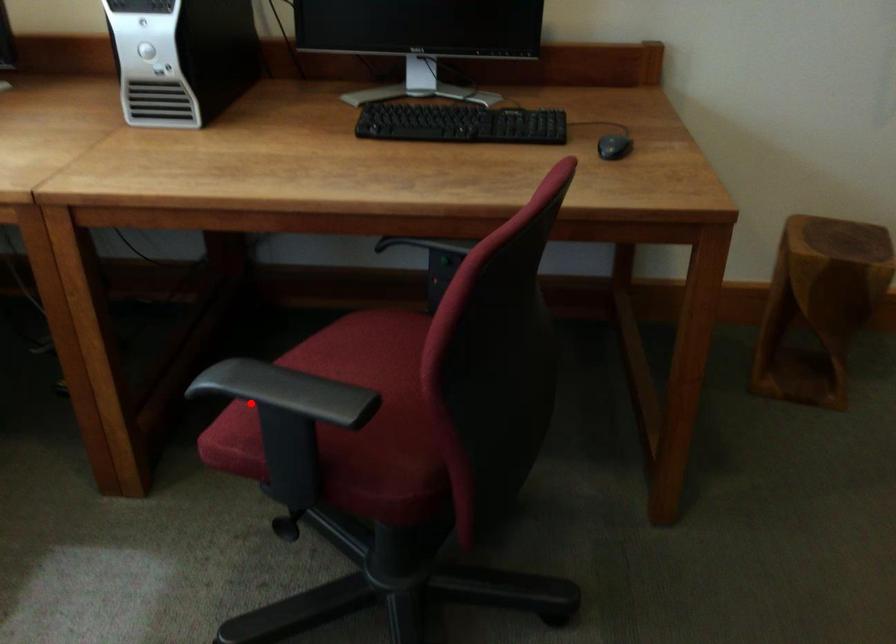
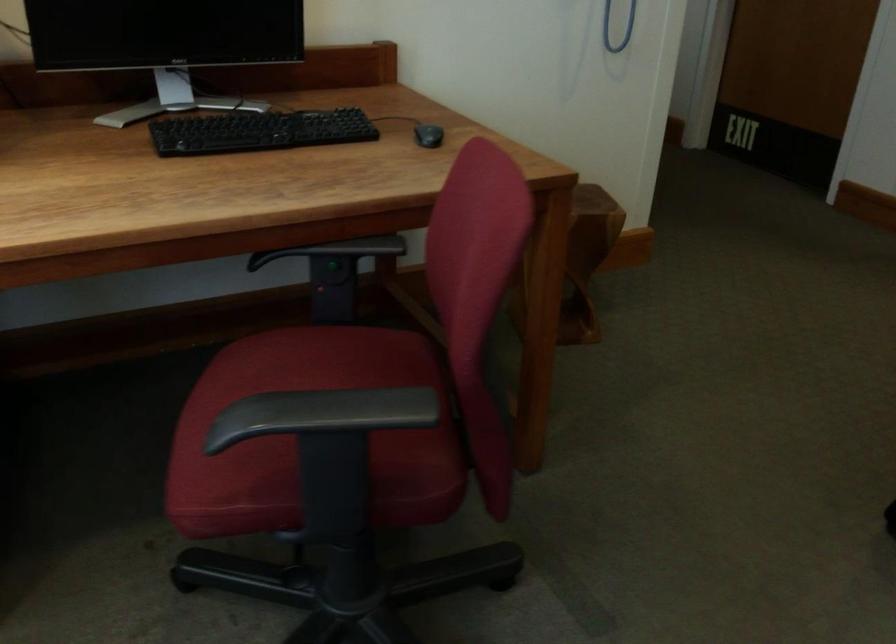
Question: I am providing you with two images of the same scene from different viewpoints. A red point is shown in image1. For the corresponding object point in image2, is it positioned nearer or farther from the camera?

Choices:
 (A) Nearer
 (B) Farther

Answer: (A)